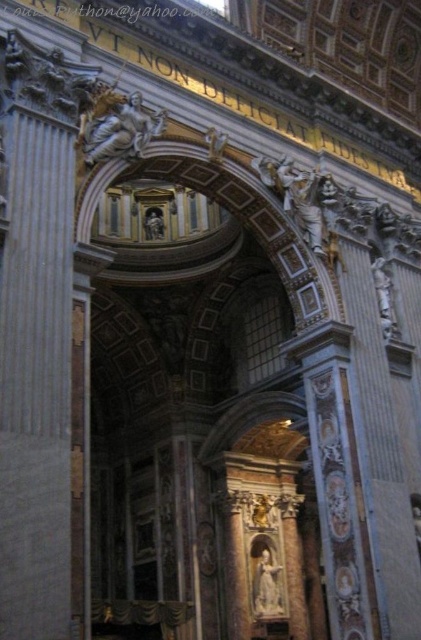
You are standing inside the grand cathedral and notice two points marked on the wall. The first point is at coordinates point (253, 593) and the second is at point (380, 317). Which point is closer to you as you face the archway?

Point (253, 593) is closer to you because it is further to the viewer than point (380, 317).

You are an architect designing a new cathedral and want to ensure there is enough space between the white marble statue at upper center and the white marble statue at center for a 150 feet long ceremonial walkway. Based on the image, is this feasible?

The distance between the white marble statue at upper center and the white marble statue at center is 154.75 feet, which is longer than the 150 feet required for the ceremonial walkway. Therefore, it is feasible to accommodate the walkway between them.

Consider the image. You are an architect designing a new cathedral and want to ensure the white marble statue at center is visible from the entrance. Given that the point representing the statue is at coordinates point (266, 580), what is the statue positioned relative to the entrance?

The white marble statue at center is positioned at coordinates point (266, 580), which places it centrally within the cathedral, ensuring it is clearly visible from the entrance.